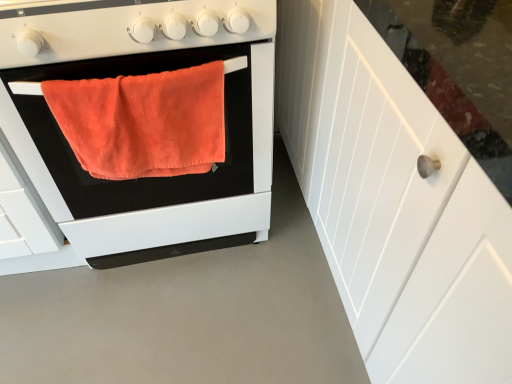
What do you see at coordinates (394, 203) in the screenshot? This screenshot has width=512, height=384. I see `white wood cabinet at right` at bounding box center [394, 203].

Describe the element at coordinates (143, 122) in the screenshot. This screenshot has width=512, height=384. I see `orange plush towel at center` at that location.

Describe the element at coordinates (125, 30) in the screenshot. I see `matte white gas stove at center` at that location.

Locate an element on the screen. This screenshot has height=384, width=512. orange fabric towel at left is located at coordinates (144, 73).

How much distance is there between orange plush towel at center and white wood cabinet at right?

The distance of orange plush towel at center from white wood cabinet at right is 16.45 inches.

Where is `cabinetry that appears above the orange plush towel at center (from the image's perspective)`? cabinetry that appears above the orange plush towel at center (from the image's perspective) is located at coordinates (394, 203).

From the image's perspective, which is above, orange plush towel at center or white wood cabinet at right?

From the image's view, white wood cabinet at right is above.

Can you tell me how much orange plush towel at center and white wood cabinet at right differ in facing direction?

There is a 90-degree angle between the facing directions of orange plush towel at center and white wood cabinet at right.

Does white wood cabinet at right have a lesser height compared to orange plush towel at center?

No, white wood cabinet at right is not shorter than orange plush towel at center.

Considering the positions of objects white wood cabinet at right and orange plush towel at center in the image provided, who is more to the left, white wood cabinet at right or orange plush towel at center?

Positioned to the left is orange plush towel at center.

Consider the image. From a real-world perspective, which is physically above, orange fabric towel at left or matte white gas stove at center?

matte white gas stove at center, from a real-world perspective.

Is orange fabric towel at left oriented towards matte white gas stove at center?

No, orange fabric towel at left is not facing towards matte white gas stove at center.

Which is more to the right, orange fabric towel at left or matte white gas stove at center?

matte white gas stove at center is more to the right.

How different are the orientations of orange fabric towel at left and matte white gas stove at center in degrees?

0.000324 degrees.

Is matte white gas stove at center outside of orange plush towel at center?

Yes, matte white gas stove at center is outside of orange plush towel at center.

From the picture: From the image's perspective, which is below, matte white gas stove at center or orange plush towel at center?

orange plush towel at center appears lower in the image.

Is matte white gas stove at center thinner than orange plush towel at center?

No.

Can you confirm if orange plush towel at center is shorter than matte white gas stove at center?

No, orange plush towel at center is not shorter than matte white gas stove at center.

Is orange plush towel at center in contact with matte white gas stove at center?

No, orange plush towel at center is not in contact with matte white gas stove at center.

From the picture: From the image's perspective, which one is positioned lower, orange plush towel at center or matte white gas stove at center?

orange plush towel at center is shown below in the image.

Which object is further away from the camera taking this photo, orange plush towel at center or matte white gas stove at center?

orange plush towel at center.

Are matte white gas stove at center and orange fabric towel at left far apart?

Actually, matte white gas stove at center and orange fabric towel at left are a little close together.

Does matte white gas stove at center have a lesser width compared to orange fabric towel at left?

Yes, matte white gas stove at center is thinner than orange fabric towel at left.

Is matte white gas stove at center looking in the opposite direction of orange fabric towel at left?

No.

Is matte white gas stove at center smaller than white wood cabinet at right?

Yes, matte white gas stove at center is smaller than white wood cabinet at right.

From a real-world perspective, which is physically above, matte white gas stove at center or white wood cabinet at right?

From a 3D spatial view, matte white gas stove at center is above.

You are a GUI agent. You are given a task and a screenshot of the screen. Output one action in this format:
    pyautogui.click(x=<x>, y=<y>)
    Task: Click on the gas stove that is on the left side of white wood cabinet at right
    This screenshot has height=384, width=512.
    Given the screenshot: What is the action you would take?
    coord(125,30)

Where is `cabinetry above the orange plush towel at center (from the image's perspective)`? The width and height of the screenshot is (512, 384). cabinetry above the orange plush towel at center (from the image's perspective) is located at coordinates [x=394, y=203].

You are a GUI agent. You are given a task and a screenshot of the screen. Output one action in this format:
    pyautogui.click(x=<x>, y=<y>)
    Task: Click on the cabinetry that is in front of the orange plush towel at center
    This screenshot has height=384, width=512.
    Given the screenshot: What is the action you would take?
    394,203

When comparing their distances from matte white gas stove at center, does white wood cabinet at right or orange fabric towel at left seem further?

white wood cabinet at right lies further to matte white gas stove at center than the other object.

Which object lies nearer to the anchor point matte white gas stove at center, orange fabric towel at left or white wood cabinet at right?

The object closer to matte white gas stove at center is orange fabric towel at left.

Considering their positions, is white wood cabinet at right positioned further to orange plush towel at center than matte white gas stove at center?

white wood cabinet at right lies further to orange plush towel at center than the other object.

Which object lies further to the anchor point orange plush towel at center, matte white gas stove at center or white wood cabinet at right?

white wood cabinet at right lies further to orange plush towel at center than the other object.

Based on their spatial positions, is orange fabric towel at left or orange plush towel at center further from matte white gas stove at center?

Based on the image, orange fabric towel at left appears to be further to matte white gas stove at center.

Based on the photo, when comparing their distances from matte white gas stove at center, does orange plush towel at center or white wood cabinet at right seem closer?

orange plush towel at center is positioned closer to the anchor matte white gas stove at center.

Considering their positions, is orange plush towel at center positioned further to orange fabric towel at left than matte white gas stove at center?

matte white gas stove at center.

Which object lies further to the anchor point white wood cabinet at right, orange fabric towel at left or orange plush towel at center?

Based on the image, orange plush towel at center appears to be further to white wood cabinet at right.

Where is `bath towel between orange fabric towel at left and white wood cabinet at right in the horizontal direction`? The height and width of the screenshot is (384, 512). bath towel between orange fabric towel at left and white wood cabinet at right in the horizontal direction is located at coordinates 143,122.

The height and width of the screenshot is (384, 512). In order to click on oven between matte white gas stove at center and orange plush towel at center vertically in this screenshot , I will do `click(144, 73)`.

Where is `bath towel between matte white gas stove at center and white wood cabinet at right`? This screenshot has width=512, height=384. bath towel between matte white gas stove at center and white wood cabinet at right is located at coordinates (143, 122).

Locate an element on the screen. Image resolution: width=512 pixels, height=384 pixels. gas stove between orange fabric towel at left and white wood cabinet at right is located at coordinates (125, 30).